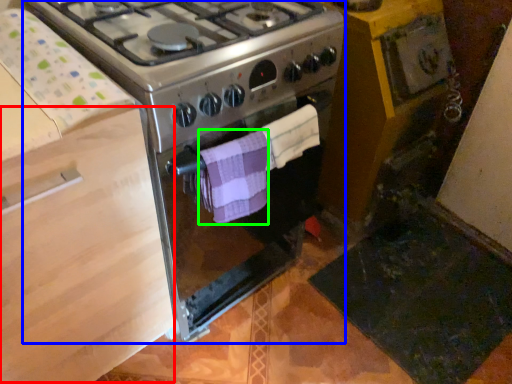
Question: Which object is positioned closest to drawer (highlighted by a red box)? Select from gas stove (highlighted by a blue box) and towel/napkin (highlighted by a green box).

Choices:
 (A) gas stove
 (B) towel/napkin

Answer: (A)